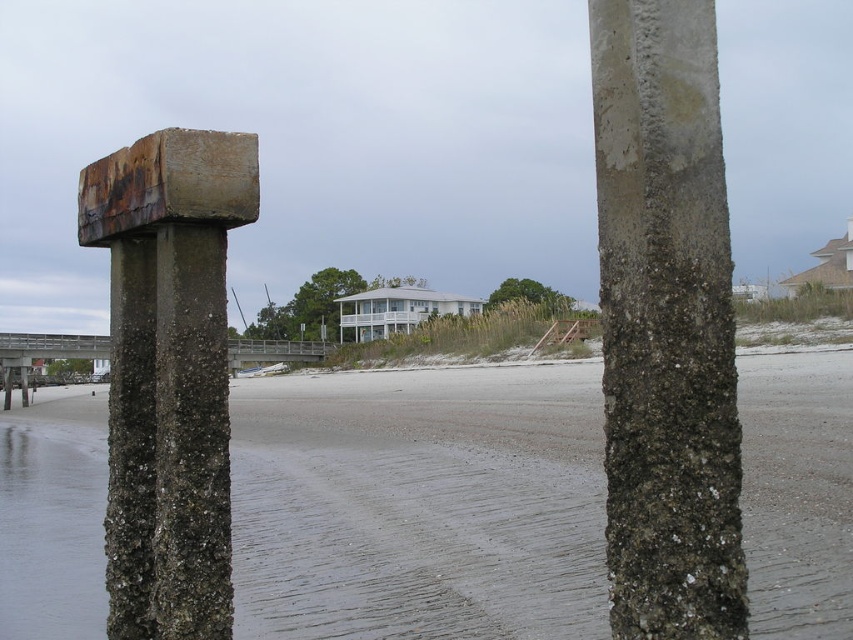
You are standing on the brown wooden dock at center and want to walk to the clear water at lower left. Is the dock higher or lower than the water?

The clear water at lower left has a greater height compared to the brown wooden dock at center, so the dock is lower than the water.

You are standing on the beach looking towards the house. You see the clear water at lower left and the brown wooden dock at center. Which one is wider?

The clear water at lower left is wider than the brown wooden dock at center.

In the scene shown: You are standing on the beach and want to cross to the brown wooden dock at center without getting your feet wet. Can you step onto the dock directly from the clear water at lower left?

The clear water at lower left is to the left of the brown wooden dock at center, so you can step onto the dock directly from the clear water at lower left without getting your feet wet.